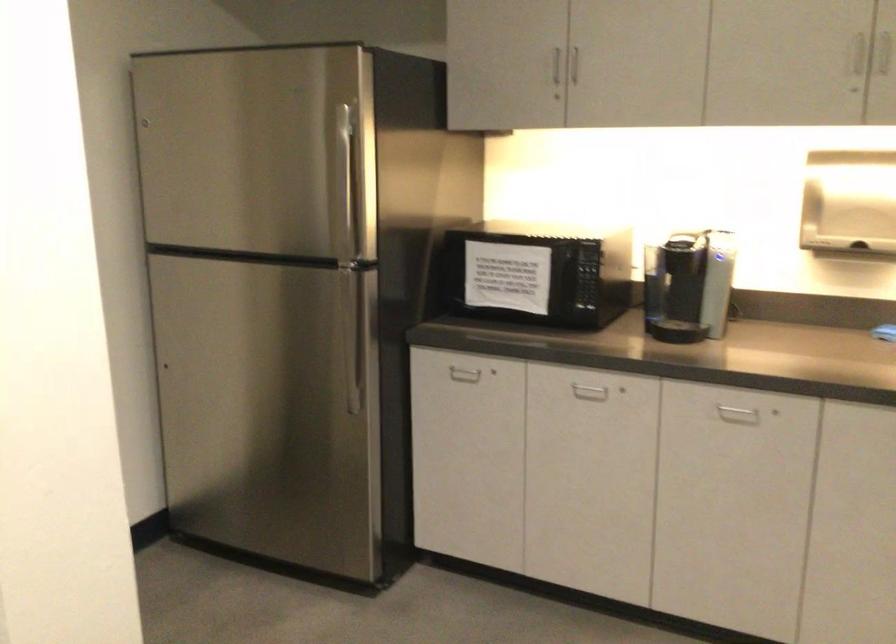
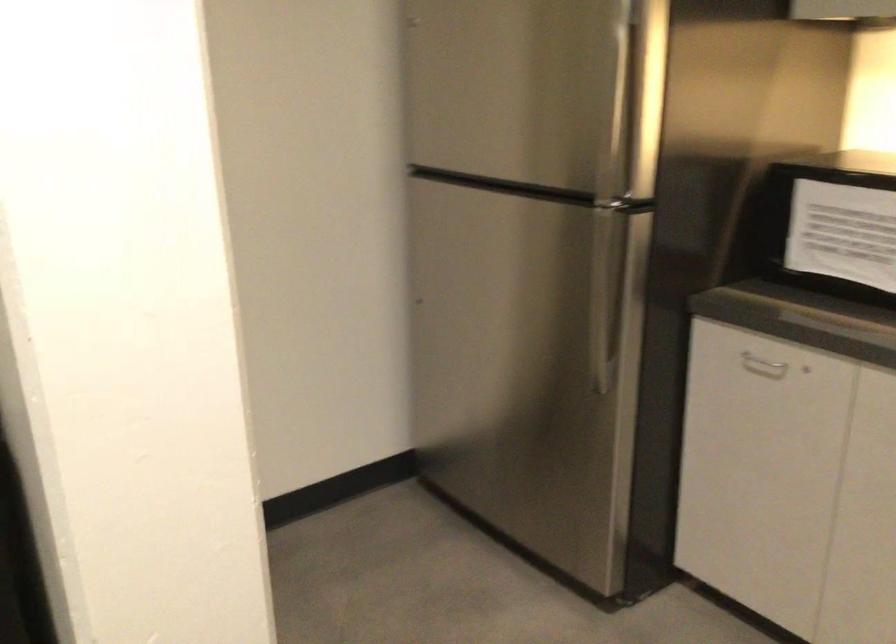
Question: The images are taken continuously from a first-person perspective. In which direction are you moving?

Choices:
 (A) Left
 (B) Right
 (C) Forward
 (D) Backward

Answer: (C)